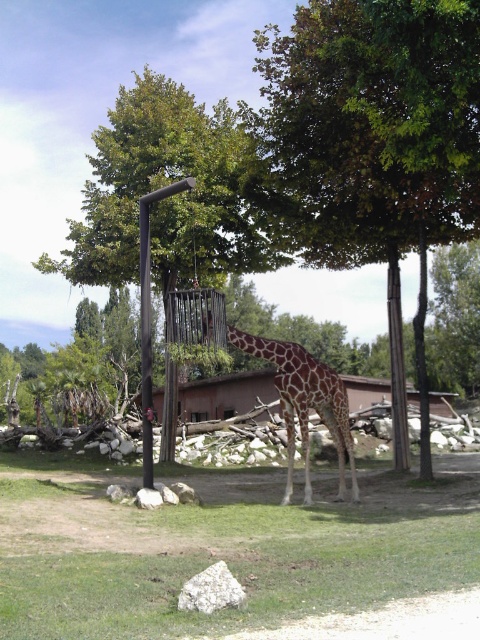
Looking at this image, which is more to the right, green grass at lower center or green leafy tree at center?

From the viewer's perspective, green leafy tree at center appears more on the right side.

Between green grass at lower center and green leafy tree at center, which one is positioned higher?

green leafy tree at center

Is point (418, 624) more distant than point (402, 108)?

That is False.

Locate an element on the screen. The image size is (480, 640). green grass at lower center is located at coordinates (226, 548).

Can you confirm if spotted fur giraffe at center is wider than black metal pole at center?

Incorrect, spotted fur giraffe at center's width does not surpass black metal pole at center's.

Is spotted fur giraffe at center smaller than black metal pole at center?

Correct, spotted fur giraffe at center occupies less space than black metal pole at center.

Find the location of a particular element. spotted fur giraffe at center is located at coordinates (304, 403).

Looking at this image, which is more to the left, green grass at lower center or spotted fur giraffe at center?

From the viewer's perspective, green grass at lower center appears more on the left side.

Can you confirm if green grass at lower center is taller than spotted fur giraffe at center?

Yes.

Is point (2, 563) closer to camera compared to point (307, 372)?

Yes, point (2, 563) is closer to viewer.

Image resolution: width=480 pixels, height=640 pixels. Identify the location of green grass at lower center. (226, 548).